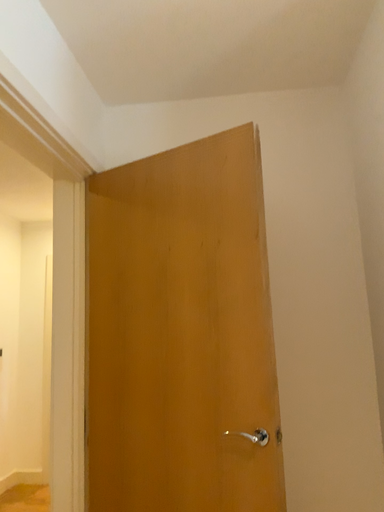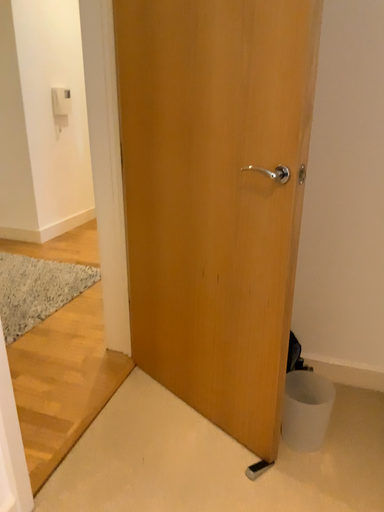
Question: Which way did the camera rotate in the video?

Choices:
 (A) rotated upward
 (B) rotated downward

Answer: (B)